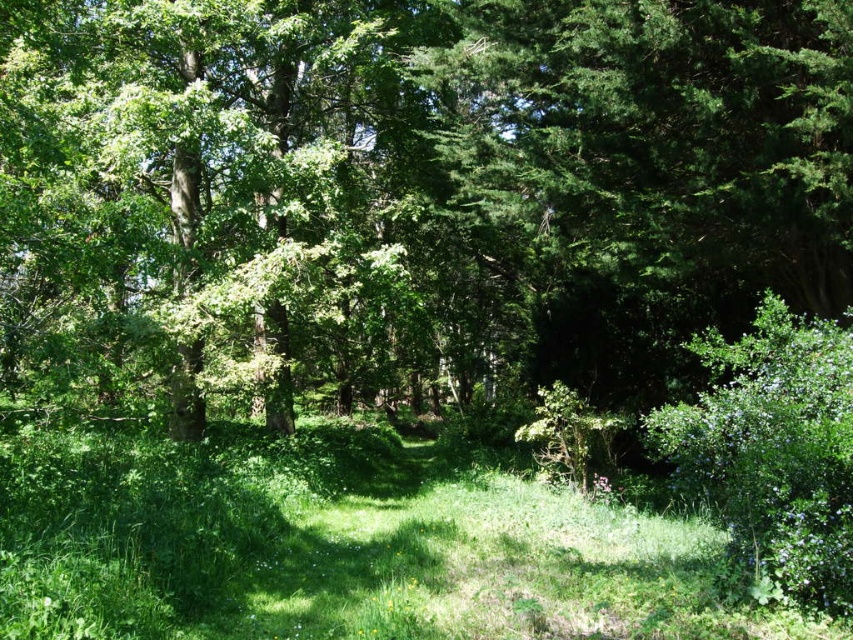
Question: Is green leafy tree at center behind green grass at center?

Choices:
 (A) yes
 (B) no

Answer: (A)

Question: Which of the following is the farthest from the observer?

Choices:
 (A) green leafy tree at center
 (B) green grass at center

Answer: (A)

Question: Which point is farther to the camera?

Choices:
 (A) green leafy tree at center
 (B) green grass at center

Answer: (A)

Question: Does green leafy tree at center appear on the left side of green grass at center?

Choices:
 (A) no
 (B) yes

Answer: (A)

Question: Observing the image, what is the correct spatial positioning of green leafy tree at center in reference to green grass at center?

Choices:
 (A) right
 (B) left

Answer: (A)